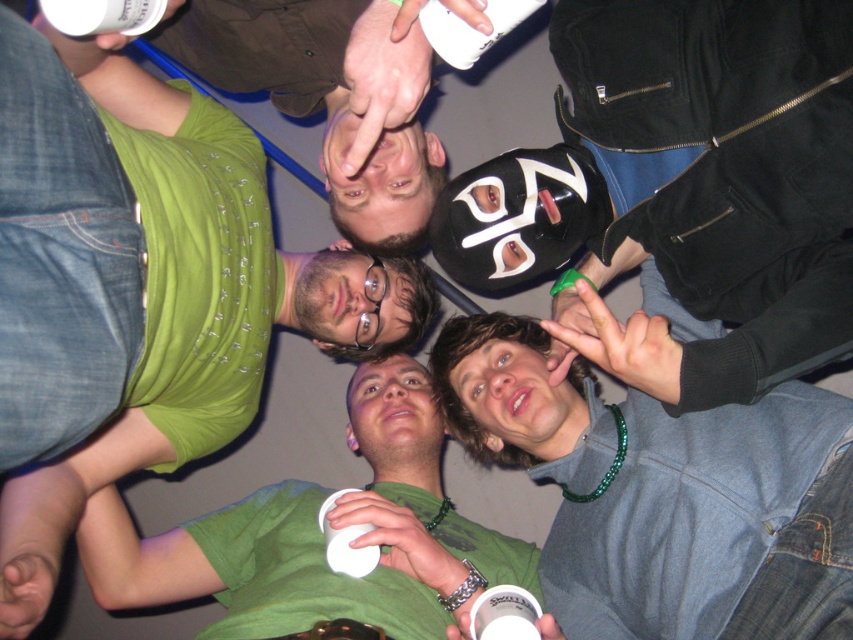
You are a photographer trying to capture a clear shot of the matte black mask at upper center and the green matte shirt at center. Since the camera can only focus on one object at a time, which object should you choose to ensure it appears sharp and in focus?

The matte black mask at upper center is smaller than the green matte shirt at center, so it would be better to focus on the green matte shirt at center to ensure it appears sharp and in focus.